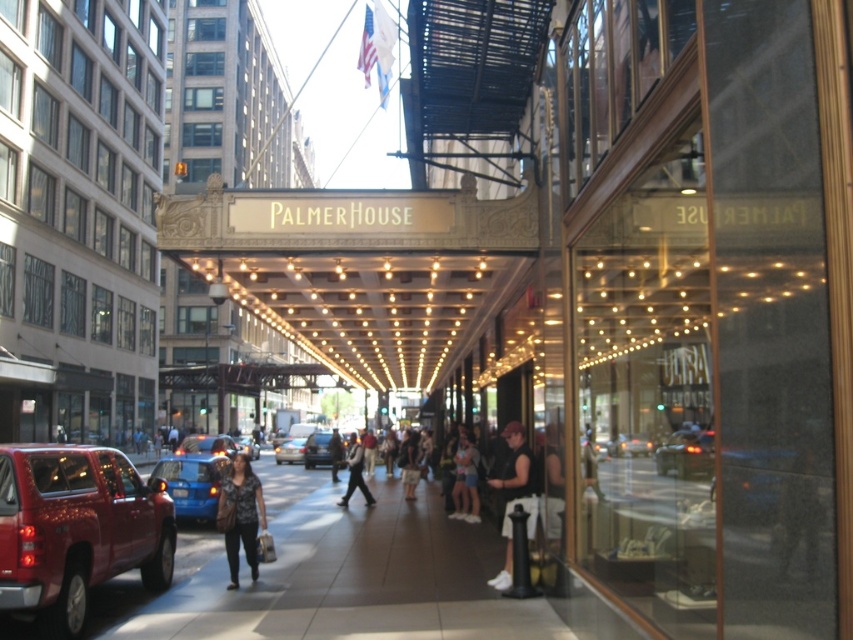
Between point (229, 556) and point (166, 483), which one is positioned behind?

The point (166, 483) is more distant.

Can you confirm if dark gray textured pants at center is bigger than blue glossy car at center?

Incorrect, dark gray textured pants at center is not larger than blue glossy car at center.

Who is more forward, (x=239, y=508) or (x=199, y=492)?

Point (x=239, y=508) is in front.

You are a GUI agent. You are given a task and a screenshot of the screen. Output one action in this format:
    pyautogui.click(x=<x>, y=<y>)
    Task: Click on the dark gray textured pants at center
    
    Given the screenshot: What is the action you would take?
    pyautogui.click(x=241, y=515)

Does metallic red truck at lower left come behind blue metallic sedan at center?

No, metallic red truck at lower left is closer to the viewer.

Can you confirm if metallic red truck at lower left is positioned below blue metallic sedan at center?

Actually, metallic red truck at lower left is above blue metallic sedan at center.

This screenshot has height=640, width=853. I want to click on metallic red truck at lower left, so click(76, 529).

Is point (183, 508) less distant than point (192, 451)?

Yes, it is.

Consider the image. Is blue glossy car at center positioned at the back of blue metallic car at center?

No.

Is point (177, 516) positioned in front of point (183, 442)?

Yes, point (177, 516) is in front of point (183, 442).

You are a GUI agent. You are given a task and a screenshot of the screen. Output one action in this format:
    pyautogui.click(x=<x>, y=<y>)
    Task: Click on the blue glossy car at center
    This screenshot has width=853, height=640.
    Given the screenshot: What is the action you would take?
    pyautogui.click(x=193, y=483)